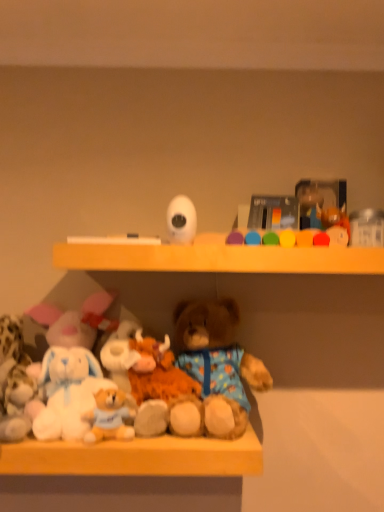
Measure the distance between fluffy beige teddy bear at lower left, which is the first toy from bottom to top, and camera.

fluffy beige teddy bear at lower left, which is the first toy from bottom to top, is 32.70 inches from camera.

Where is `fluffy white stuffed animal at lower left, the third toy from the top`? This screenshot has width=384, height=512. fluffy white stuffed animal at lower left, the third toy from the top is located at coordinates (14, 381).

What is the approximate width of fluffy white stuffed animal at lower left, the third toy from the top?

The width of fluffy white stuffed animal at lower left, the third toy from the top, is 5.77 inches.

Describe the element at coordinates (312, 239) in the screenshot. I see `glossy plastic toy at upper center, which is the 3th toy from bottom to top` at that location.

Locate an element on the screen. glossy plastic toy at upper center, which is the first toy in right-to-left order is located at coordinates (312, 239).

The image size is (384, 512). I want to click on white plush toys at lower center, so click(128, 474).

This screenshot has height=512, width=384. What are the coordinates of `fluffy beige teddy bear at lower left, the fourth toy positioned from the top` in the screenshot? It's located at (110, 416).

Is white matte camera at upper center, acting as the fourth toy starting from the bottom, not inside white plush toys at lower center?

Yes, white matte camera at upper center, acting as the fourth toy starting from the bottom, is located beyond the bounds of white plush toys at lower center.

Between white matte camera at upper center, acting as the fourth toy starting from the bottom, and white plush toys at lower center, which one has smaller size?

white matte camera at upper center, acting as the fourth toy starting from the bottom.

Can you confirm if white matte camera at upper center, which ranks as the 3th toy in left-to-right order, is thinner than white plush toys at lower center?

Yes, white matte camera at upper center, which ranks as the 3th toy in left-to-right order, is thinner than white plush toys at lower center.

What's the angular difference between white matte camera at upper center, acting as the fourth toy starting from the bottom, and white plush toys at lower center's facing directions?

white matte camera at upper center, acting as the fourth toy starting from the bottom, and white plush toys at lower center are facing 0.772 degrees away from each other.

How different are the orientations of fluffy beige teddy bear at lower left, the second toy from the left, and fluffy brown teddy bear at center in degrees?

fluffy beige teddy bear at lower left, the second toy from the left, and fluffy brown teddy bear at center are facing 0.826 degrees away from each other.

Is fluffy beige teddy bear at lower left, which is the third toy from right to left, located outside fluffy brown teddy bear at center?

Indeed, fluffy beige teddy bear at lower left, which is the third toy from right to left, is completely outside fluffy brown teddy bear at center.

Considering the points (118, 412) and (232, 352), which point is in front, point (118, 412) or point (232, 352)?

The point (118, 412) is closer.

Consider the image. From the image's perspective, relative to fluffy brown teddy bear at center, is fluffy beige teddy bear at lower left, the fourth toy positioned from the top, above or below?

fluffy beige teddy bear at lower left, the fourth toy positioned from the top, is below fluffy brown teddy bear at center.

In the image, is white matte camera at upper center, the first toy positioned from the top, on the left side or the right side of fluffy brown teddy bear at center?

white matte camera at upper center, the first toy positioned from the top, is positioned on fluffy brown teddy bear at center's left side.

Is point (177, 216) positioned in front of point (252, 361)?

Yes.

Looking at the image, does white matte camera at upper center, positioned as the second toy in right-to-left order, seem bigger or smaller compared to fluffy brown teddy bear at center?

white matte camera at upper center, positioned as the second toy in right-to-left order, is smaller than fluffy brown teddy bear at center.

From the image's perspective, is fluffy brown teddy bear at center on white matte camera at upper center, acting as the fourth toy starting from the bottom?

No.

Between fluffy brown teddy bear at center and white matte camera at upper center, which ranks as the 3th toy in left-to-right order, which one has larger width?

Wider between the two is fluffy brown teddy bear at center.

Does fluffy brown teddy bear at center turn towards white matte camera at upper center, the first toy positioned from the top?

No, fluffy brown teddy bear at center is not oriented towards white matte camera at upper center, the first toy positioned from the top.

From the picture: Is fluffy brown teddy bear at center bigger than white matte camera at upper center, the first toy positioned from the top?

Indeed, fluffy brown teddy bear at center has a larger size compared to white matte camera at upper center, the first toy positioned from the top.

Who is bigger, glossy plastic toy at upper center, which is the 3th toy from bottom to top, or white matte camera at upper center, acting as the fourth toy starting from the bottom?

With larger size is glossy plastic toy at upper center, which is the 3th toy from bottom to top.

Starting from the white matte camera at upper center, acting as the fourth toy starting from the bottom, which toy is the 1st one behind? Please provide its 2D coordinates.

[(312, 239)]

Is glossy plastic toy at upper center, placed as the fourth toy when sorted from left to right, to the left of white matte camera at upper center, the first toy positioned from the top, from the viewer's perspective?

In fact, glossy plastic toy at upper center, placed as the fourth toy when sorted from left to right, is to the right of white matte camera at upper center, the first toy positioned from the top.

Is glossy plastic toy at upper center, which is the 3th toy from bottom to top, not inside white matte camera at upper center, positioned as the second toy in right-to-left order?

Yes, glossy plastic toy at upper center, which is the 3th toy from bottom to top, is not within white matte camera at upper center, positioned as the second toy in right-to-left order.

From the image's perspective, which object appears higher, white plush toys at lower center or fluffy white stuffed animal at lower left, arranged as the 4th toy when viewed from the right?

fluffy white stuffed animal at lower left, arranged as the 4th toy when viewed from the right, from the image's perspective.

Who is smaller, white plush toys at lower center or fluffy white stuffed animal at lower left, acting as the first toy starting from the left?

With smaller size is fluffy white stuffed animal at lower left, acting as the first toy starting from the left.

Is white plush toys at lower center positioned behind fluffy white stuffed animal at lower left, acting as the first toy starting from the left?

No, it is not.

Can you confirm if white plush toys at lower center is shorter than fluffy white stuffed animal at lower left, the third toy from the top?

Yes, white plush toys at lower center is shorter than fluffy white stuffed animal at lower left, the third toy from the top.

Would you consider white matte camera at upper center, the first toy positioned from the top, to be distant from glossy plastic toy at upper center, which is the first toy in right-to-left order?

No, white matte camera at upper center, the first toy positioned from the top, is not far away from glossy plastic toy at upper center, which is the first toy in right-to-left order.

From the image's perspective, between white matte camera at upper center, positioned as the second toy in right-to-left order, and glossy plastic toy at upper center, which is the 2th toy from top to bottom, who is located below?

glossy plastic toy at upper center, which is the 2th toy from top to bottom, appears lower in the image.

From a real-world perspective, is white matte camera at upper center, acting as the fourth toy starting from the bottom, located beneath glossy plastic toy at upper center, which is the 2th toy from top to bottom?

No, from a real-world perspective, white matte camera at upper center, acting as the fourth toy starting from the bottom, is not below glossy plastic toy at upper center, which is the 2th toy from top to bottom.

Does white matte camera at upper center, which ranks as the 3th toy in left-to-right order, have a smaller size compared to glossy plastic toy at upper center, which is the 2th toy from top to bottom?

Correct, white matte camera at upper center, which ranks as the 3th toy in left-to-right order, occupies less space than glossy plastic toy at upper center, which is the 2th toy from top to bottom.

Where is `the 4th toy positioned above the white plush toys at lower center (from the image's perspective)`? the 4th toy positioned above the white plush toys at lower center (from the image's perspective) is located at coordinates (181, 219).

Where is `teddy bear lying on the right of fluffy beige teddy bear at lower left, the fourth toy positioned from the top`? This screenshot has height=512, width=384. teddy bear lying on the right of fluffy beige teddy bear at lower left, the fourth toy positioned from the top is located at coordinates (215, 367).

Based on their spatial positions, is white matte camera at upper center, positioned as the second toy in right-to-left order, or fluffy brown teddy bear at center closer to white plush toys at lower center?

fluffy brown teddy bear at center is positioned closer to the anchor white plush toys at lower center.

When comparing their distances from white matte camera at upper center, which ranks as the 3th toy in left-to-right order, does white plush toys at lower center or fluffy beige teddy bear at lower left, the fourth toy positioned from the top, seem further?

white plush toys at lower center is positioned further to the anchor white matte camera at upper center, which ranks as the 3th toy in left-to-right order.

Looking at the image, which one is located closer to fluffy brown teddy bear at center, glossy plastic toy at upper center, which is the first toy in right-to-left order, or fluffy white stuffed animal at lower left, the third toy from the top?

glossy plastic toy at upper center, which is the first toy in right-to-left order, lies closer to fluffy brown teddy bear at center than the other object.

From the image, which object appears to be farther from white plush toys at lower center, glossy plastic toy at upper center, which is the 3th toy from bottom to top, or white matte camera at upper center, positioned as the second toy in right-to-left order?

Among the two, glossy plastic toy at upper center, which is the 3th toy from bottom to top, is located further to white plush toys at lower center.

Estimate the real-world distances between objects in this image. Which object is further from fluffy brown teddy bear at center, white matte camera at upper center, acting as the fourth toy starting from the bottom, or glossy plastic toy at upper center, which is the first toy in right-to-left order?

white matte camera at upper center, acting as the fourth toy starting from the bottom, is positioned further to the anchor fluffy brown teddy bear at center.

Estimate the real-world distances between objects in this image. Which object is further from white plush toys at lower center, white matte camera at upper center, the first toy positioned from the top, or glossy plastic toy at upper center, which is the 2th toy from top to bottom?

glossy plastic toy at upper center, which is the 2th toy from top to bottom, is positioned further to the anchor white plush toys at lower center.

Considering their positions, is glossy plastic toy at upper center, which is the 2th toy from top to bottom, positioned closer to white matte camera at upper center, positioned as the second toy in right-to-left order, than white plush toys at lower center?

Among the two, glossy plastic toy at upper center, which is the 2th toy from top to bottom, is located nearer to white matte camera at upper center, positioned as the second toy in right-to-left order.

Consider the image. Looking at the image, which one is located closer to fluffy white stuffed animal at lower left, arranged as the 4th toy when viewed from the right, fluffy brown teddy bear at center or white matte camera at upper center, acting as the fourth toy starting from the bottom?

The object closer to fluffy white stuffed animal at lower left, arranged as the 4th toy when viewed from the right, is fluffy brown teddy bear at center.

Where is `table situated between fluffy white stuffed animal at lower left, the second toy positioned from the bottom, and glossy plastic toy at upper center, which is the 2th toy from top to bottom, from left to right`? table situated between fluffy white stuffed animal at lower left, the second toy positioned from the bottom, and glossy plastic toy at upper center, which is the 2th toy from top to bottom, from left to right is located at coordinates (128, 474).

At what (x,y) coordinates should I click in order to perform the action: click on toy situated between fluffy white stuffed animal at lower left, the second toy positioned from the bottom, and white plush toys at lower center from left to right. Please return your answer as a coordinate pair (x, y). The image size is (384, 512). Looking at the image, I should click on (110, 416).

At what (x,y) coordinates should I click in order to perform the action: click on table between fluffy white stuffed animal at lower left, the second toy positioned from the bottom, and fluffy brown teddy bear at center. Please return your answer as a coordinate pair (x, y). The height and width of the screenshot is (512, 384). Looking at the image, I should click on (128, 474).

You are a GUI agent. You are given a task and a screenshot of the screen. Output one action in this format:
    pyautogui.click(x=<x>, y=<y>)
    Task: Click on the teddy bear between fluffy white stuffed animal at lower left, acting as the first toy starting from the left, and glossy plastic toy at upper center, which is the first toy in right-to-left order, from left to right
    The width and height of the screenshot is (384, 512).
    Given the screenshot: What is the action you would take?
    pyautogui.click(x=215, y=367)